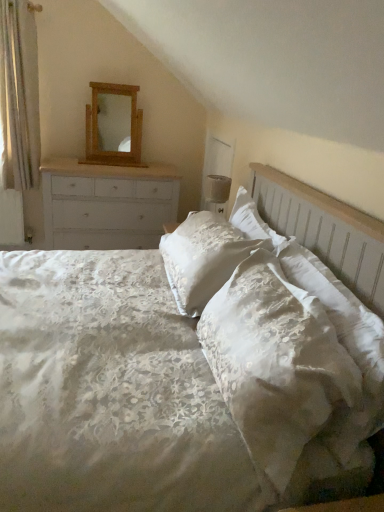
Question: Relative to matte white lampshade at upper right, is wooden mirror at upper center in front or behind?

Choices:
 (A) behind
 (B) front

Answer: (A)

Question: Based on their sizes in the image, would you say wooden mirror at upper center is bigger or smaller than matte white lampshade at upper right?

Choices:
 (A) small
 (B) big

Answer: (B)

Question: Estimate the real-world distances between objects in this image. Which object is farther from the white sheer curtain at left?

Choices:
 (A) wooden mirror at upper center
 (B) matte white lampshade at upper right
 (C) white painted wood chest of drawers at left
 (D) linen bed at center
 (E) white satin pillow at center

Answer: (E)

Question: Which object is positioned farthest from the white painted wood chest of drawers at left?

Choices:
 (A) linen bed at center
 (B) wooden mirror at upper center
 (C) matte white lampshade at upper right
 (D) white satin pillow at center
 (E) white sheer curtain at left

Answer: (D)